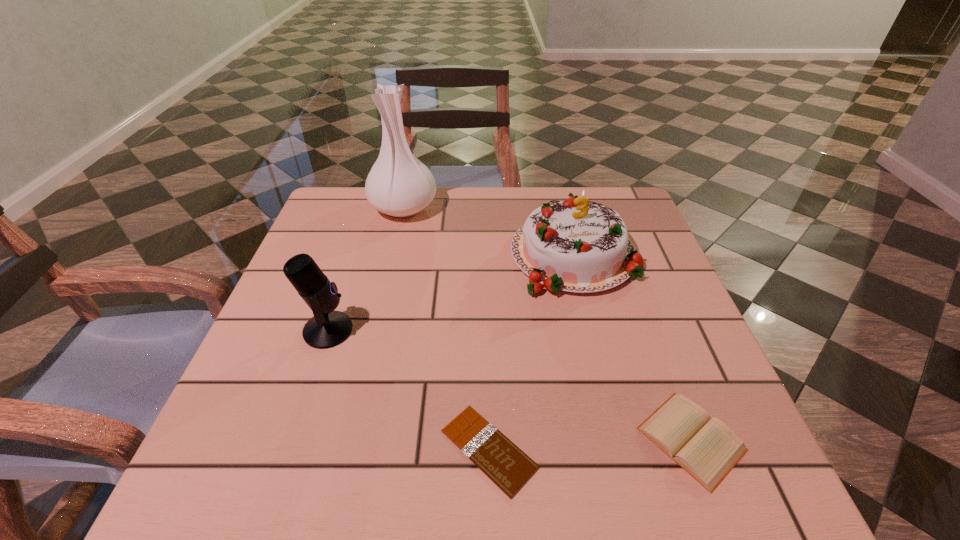
This screenshot has width=960, height=540. Find the location of `vase located in the far edge section of the desktop`. vase located in the far edge section of the desktop is located at coordinates (400, 185).

You are a GUI agent. You are given a task and a screenshot of the screen. Output one action in this format:
    pyautogui.click(x=<x>, y=<y>)
    Task: Click on the cake present at the far edge
    
    Given the screenshot: What is the action you would take?
    pyautogui.click(x=573, y=246)

Locate an element on the screen. This screenshot has width=960, height=540. diary located at the near edge is located at coordinates (707, 449).

The image size is (960, 540). Identify the location of chocolate bar present at the near edge. (506, 465).

Identify the location of vase that is at the left edge. (400, 185).

Identify the location of microphone located at the left edge. (327, 328).

Find the location of a particular element. cake that is at the right edge is located at coordinates (573, 246).

Locate an element on the screen. This screenshot has height=540, width=960. diary situated at the right edge is located at coordinates (707, 449).

At what (x,y) coordinates should I click in order to perform the action: click on object located at the far left corner. Please return your answer as a coordinate pair (x, y). The height and width of the screenshot is (540, 960). Looking at the image, I should click on (400, 185).

You are a GUI agent. You are given a task and a screenshot of the screen. Output one action in this format:
    pyautogui.click(x=<x>, y=<y>)
    Task: Click on the object located in the far right corner section of the desktop
    The height and width of the screenshot is (540, 960).
    Given the screenshot: What is the action you would take?
    pyautogui.click(x=573, y=246)